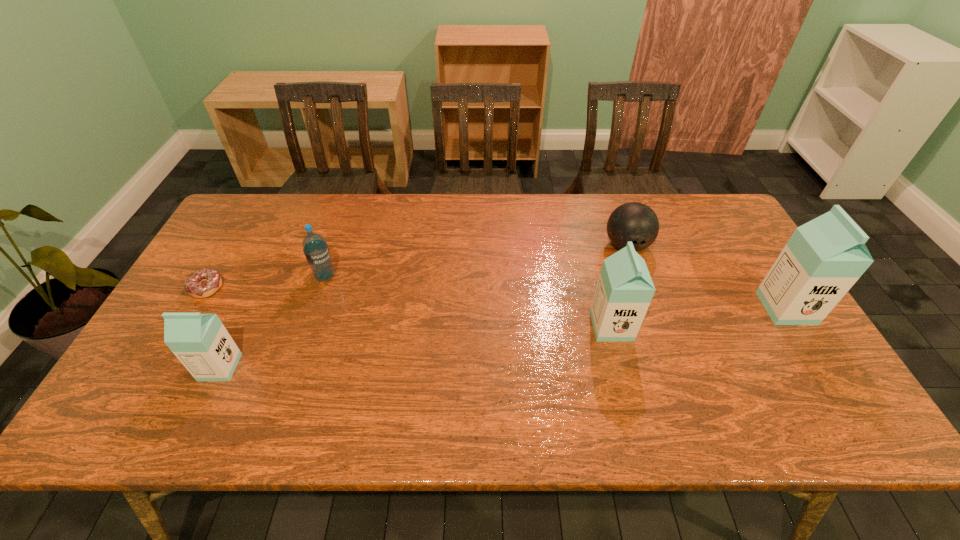
Where is `vacant space in between the third object from left to right and the leftmost object`? The height and width of the screenshot is (540, 960). vacant space in between the third object from left to right and the leftmost object is located at coordinates (266, 282).

The image size is (960, 540). In order to click on free spot between the water bottle and the rightmost object in this screenshot , I will do `click(556, 292)`.

Find the location of `vacant region between the tallest milk carton and the leftmost object`. vacant region between the tallest milk carton and the leftmost object is located at coordinates pos(496,298).

Locate an element on the screen. The image size is (960, 540). unoccupied position between the fifth object from right to left and the second shortest object is located at coordinates (423, 307).

You are a GUI agent. You are given a task and a screenshot of the screen. Output one action in this format:
    pyautogui.click(x=<x>, y=<y>)
    Task: Click on the free spot between the doughnut and the rightmost object
    
    Given the screenshot: What is the action you would take?
    pyautogui.click(x=496, y=298)

Find the location of a particular element. The width and height of the screenshot is (960, 540). unoccupied area between the bowling ball and the water bottle is located at coordinates (476, 261).

The height and width of the screenshot is (540, 960). Identify the location of empty space between the water bottle and the fifth tallest object. (476, 261).

Identify the location of free spot between the rightmost milk carton and the second tallest object. (699, 317).

Identify the location of the second closest object to the rightmost object. The height and width of the screenshot is (540, 960). (624, 291).

Find the location of a particular element. The image size is (960, 540). object that is the second closest to the water bottle is located at coordinates (200, 341).